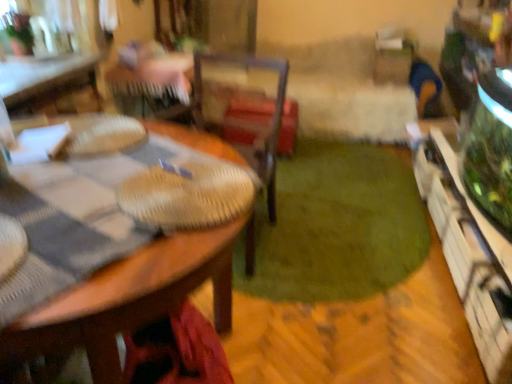
Question: From a real-world perspective, is wooden table at upper left, which is counted as the 2th table, starting from the front, physically above wooden table at center, which is counted as the 2th table, starting from the top?

Choices:
 (A) no
 (B) yes

Answer: (B)

Question: Is wooden table at upper left, the 1th table viewed from the back, beside wooden table at center, placed as the 2th table when sorted from back to front?

Choices:
 (A) yes
 (B) no

Answer: (B)

Question: Considering the relative positions of wooden table at upper left, placed as the first table when sorted from top to bottom, and wooden table at center, which is the 1th table from front to back, in the image provided, is wooden table at upper left, placed as the first table when sorted from top to bottom, to the left of wooden table at center, which is the 1th table from front to back, from the viewer's perspective?

Choices:
 (A) yes
 (B) no

Answer: (A)

Question: Is wooden table at upper left, which is counted as the 2th table, starting from the front, outside wooden table at center, which is the 1th table from front to back?

Choices:
 (A) no
 (B) yes

Answer: (B)

Question: Considering the relative positions of wooden table at upper left, the 1th table viewed from the back, and wooden table at center, which is counted as the 2th table, starting from the top, in the image provided, is wooden table at upper left, the 1th table viewed from the back, in front of wooden table at center, which is counted as the 2th table, starting from the top,?

Choices:
 (A) no
 (B) yes

Answer: (A)

Question: Is there a large distance between wooden table at upper left, the 1th table viewed from the back, and wooden table at center, the 1th table positioned from the bottom?

Choices:
 (A) no
 (B) yes

Answer: (B)

Question: Considering the relative sizes of wooden table at upper left, the 1th table viewed from the back, and green plush carpet at center in the image provided, is wooden table at upper left, the 1th table viewed from the back, smaller than green plush carpet at center?

Choices:
 (A) yes
 (B) no

Answer: (A)

Question: Can you confirm if wooden table at upper left, placed as the first table when sorted from top to bottom, is wider than green plush carpet at center?

Choices:
 (A) no
 (B) yes

Answer: (A)

Question: Is the position of wooden table at upper left, the 2th table when ordered from bottom to top, more distant than that of green plush carpet at center?

Choices:
 (A) no
 (B) yes

Answer: (B)

Question: Can you confirm if wooden table at upper left, the 2th table when ordered from bottom to top, is bigger than green plush carpet at center?

Choices:
 (A) no
 (B) yes

Answer: (A)

Question: Does wooden table at upper left, the 2th table when ordered from bottom to top, have a greater height compared to green plush carpet at center?

Choices:
 (A) no
 (B) yes

Answer: (B)

Question: Is the depth of wooden table at upper left, the 2th table when ordered from bottom to top, less than that of green plush carpet at center?

Choices:
 (A) yes
 (B) no

Answer: (B)

Question: Can you confirm if green plush carpet at center is taller than wooden table at upper left, placed as the first table when sorted from top to bottom?

Choices:
 (A) yes
 (B) no

Answer: (B)